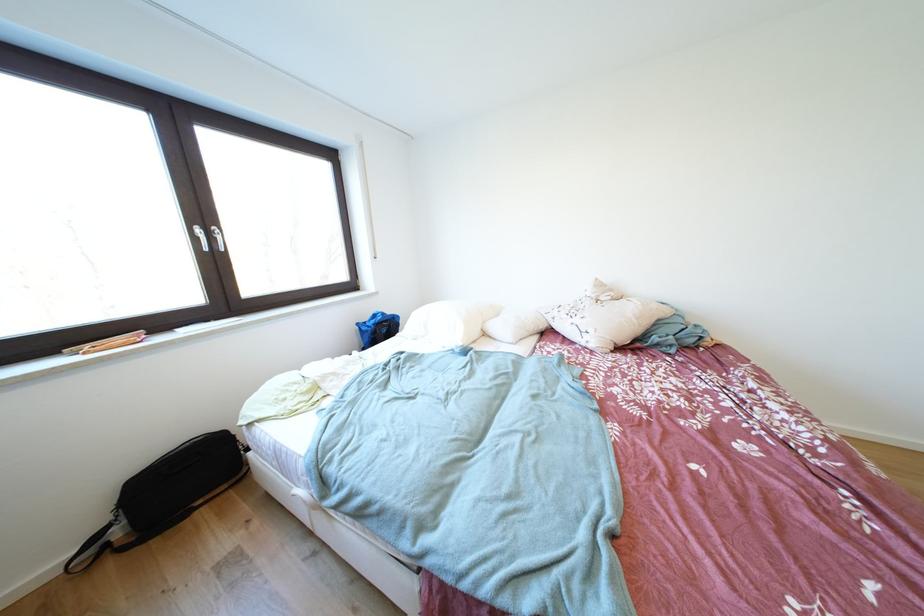
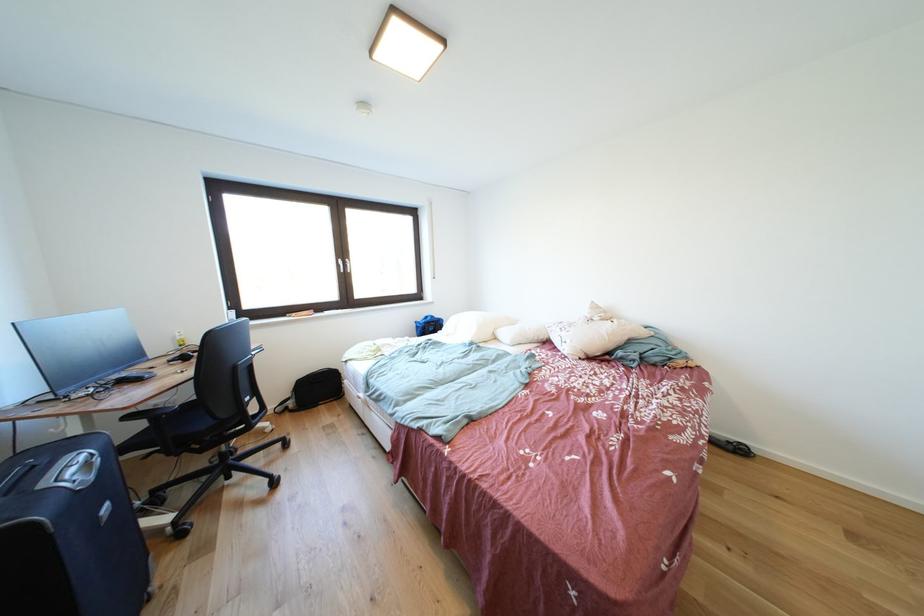
Find the pixel in the second image that matches point 585,325 in the first image.

(572, 338)